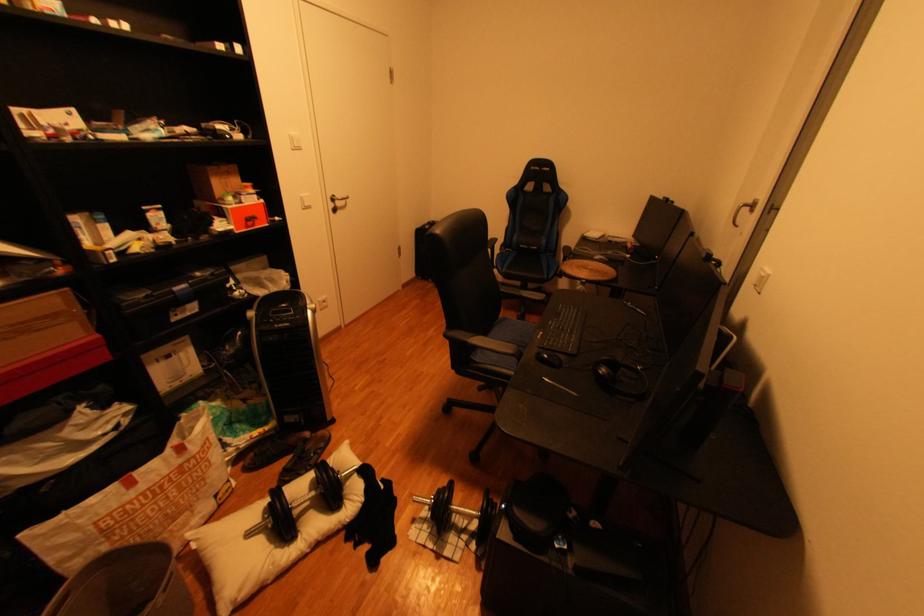
Where is `black headphones`? The width and height of the screenshot is (924, 616). black headphones is located at coordinates (624, 367).